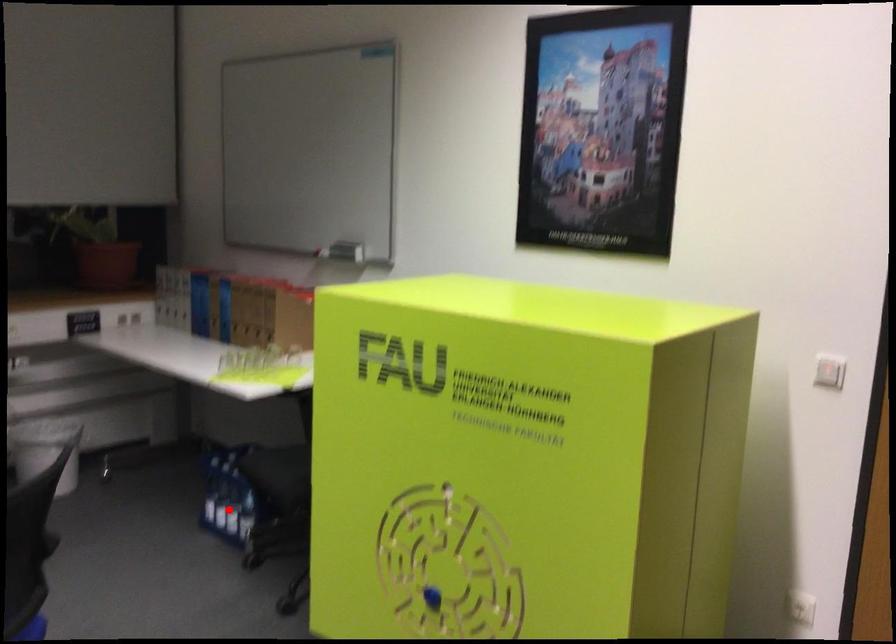
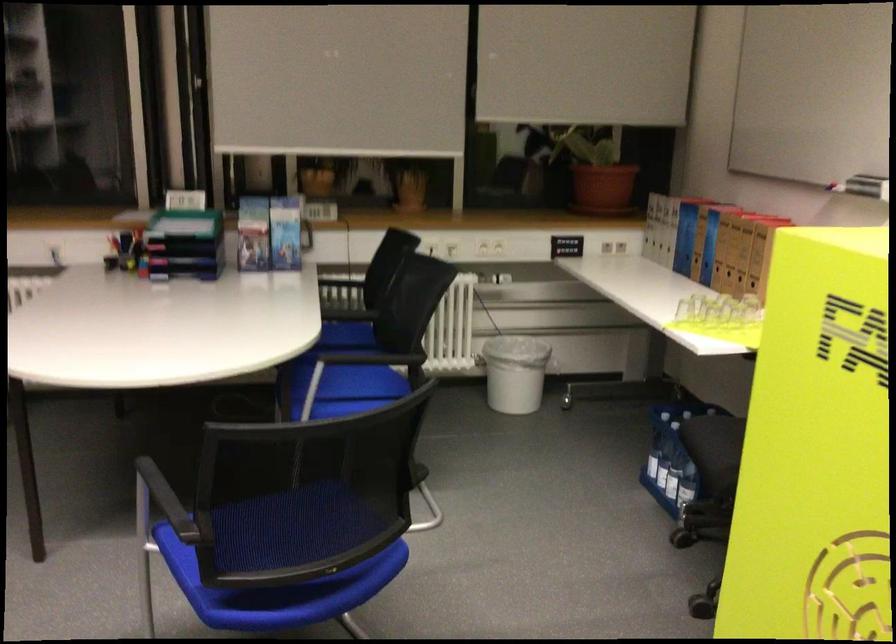
Find the pixel in the second image that matches the highlighted location in the first image.

(667, 471)